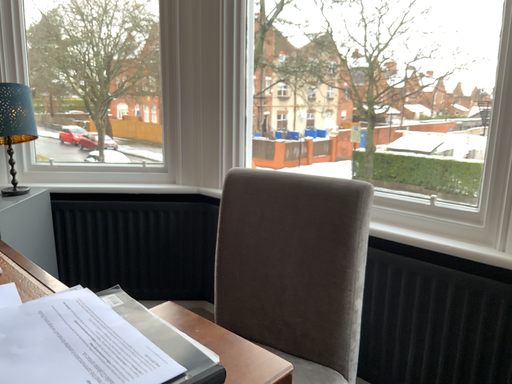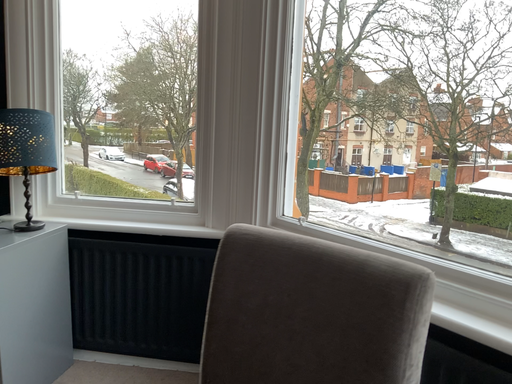
Question: Which way did the camera rotate in the video?

Choices:
 (A) rotated left
 (B) rotated right

Answer: (A)